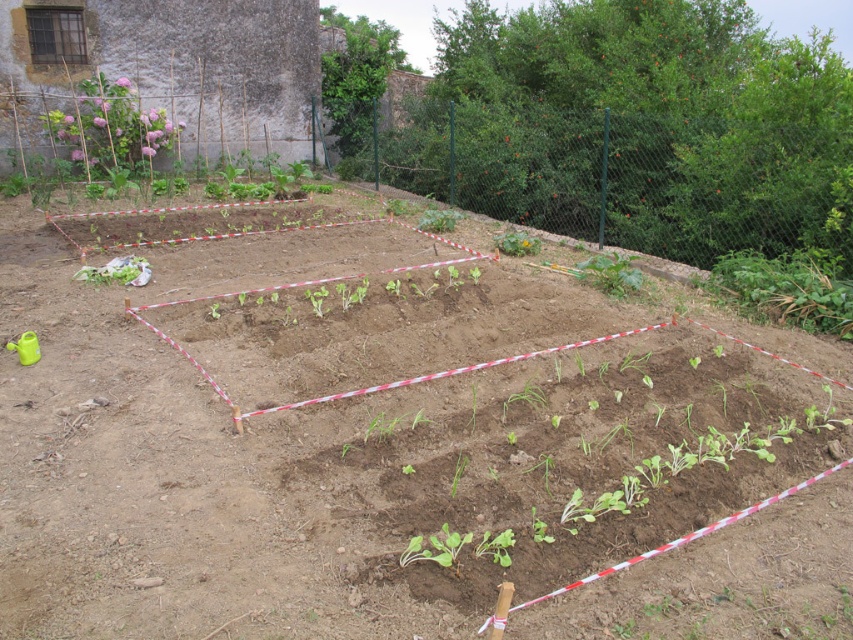
Does point (782, 273) lie in front of point (459, 541)?

That is False.

What do you see at coordinates (788, 288) in the screenshot? I see `green leafy plant at upper right` at bounding box center [788, 288].

What are the coordinates of `green leafy plant at upper right` in the screenshot? It's located at (788, 288).